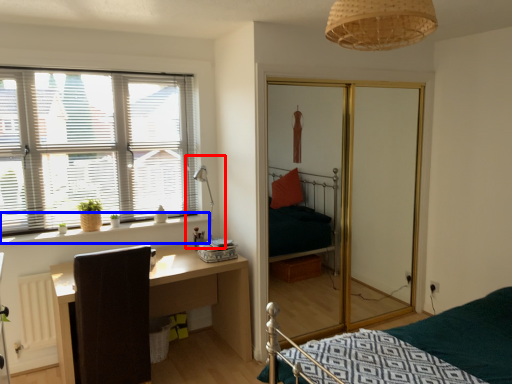
Question: Which point is further to the camera, table lamp (highlighted by a red box) or window sill (highlighted by a blue box)?

Choices:
 (A) table lamp
 (B) window sill

Answer: (A)